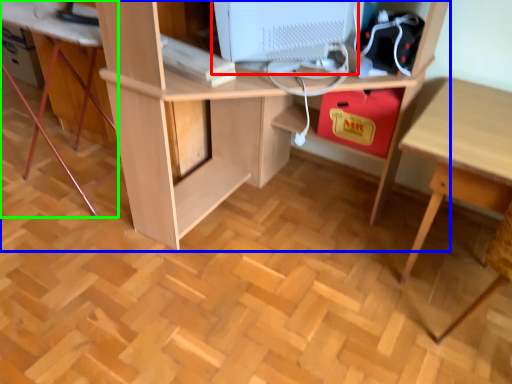
Question: Estimate the real-world distances between objects in this image. Which object is closer to computer monitor (highlighted by a red box), desk (highlighted by a blue box) or computer desk (highlighted by a green box)?

Choices:
 (A) desk
 (B) computer desk

Answer: (A)